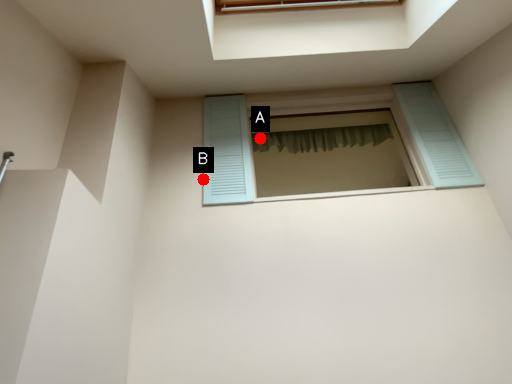
Question: Two points are circled on the image, labeled by A and B beside each circle. Which of the following is the closest to the observer?

Choices:
 (A) A is closer
 (B) B is closer

Answer: (B)